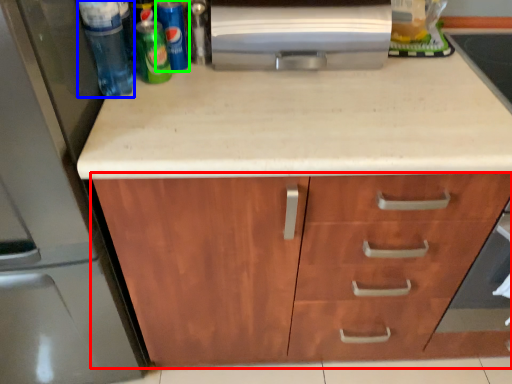
Question: Which is farther away from cabinetry (highlighted by a red box)? beverage (highlighted by a blue box) or beer (highlighted by a green box)?

Choices:
 (A) beverage
 (B) beer

Answer: (B)